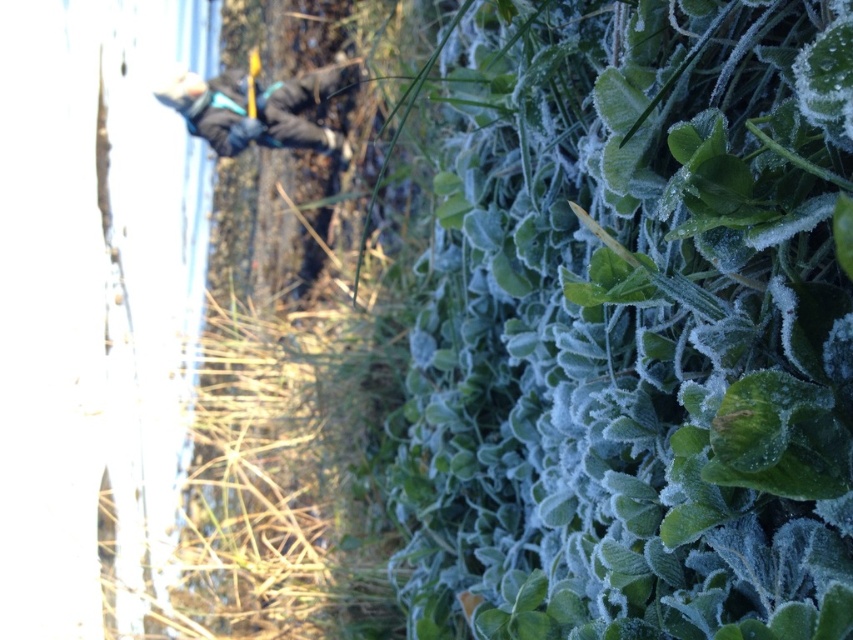
Which is below, green frosted leaves at lower right or dark gray jacket at upper left?

green frosted leaves at lower right is lower down.

Consider the image. Does green frosted leaves at lower right have a greater width compared to dark gray jacket at upper left?

Incorrect, green frosted leaves at lower right's width does not surpass dark gray jacket at upper left's.

The image size is (853, 640). In order to click on green frosted leaves at lower right in this screenshot , I will do `click(637, 326)`.